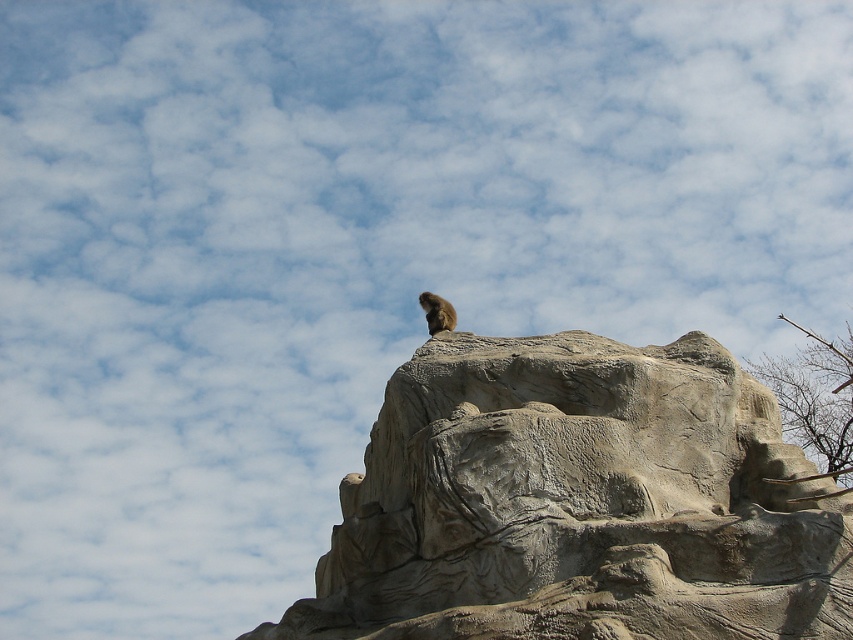
You are a hiker trying to estimate distances in the scene. You see a brown bark tree at right and a furry brown animal at top. Which object is nearer to you?

The brown bark tree at right is closer to the viewer than the furry brown animal at top.

You are a photographer planning to capture the gray stone rock at upper center and the brown bark tree at right in a single frame. Based on their sizes in the scene, which object should you focus on to ensure both are visible without cropping?

Since the gray stone rock at upper center occupies less space than the brown bark tree at right, you should focus on the brown bark tree at right to ensure both objects are visible without cropping, as it takes up more area in the frame.